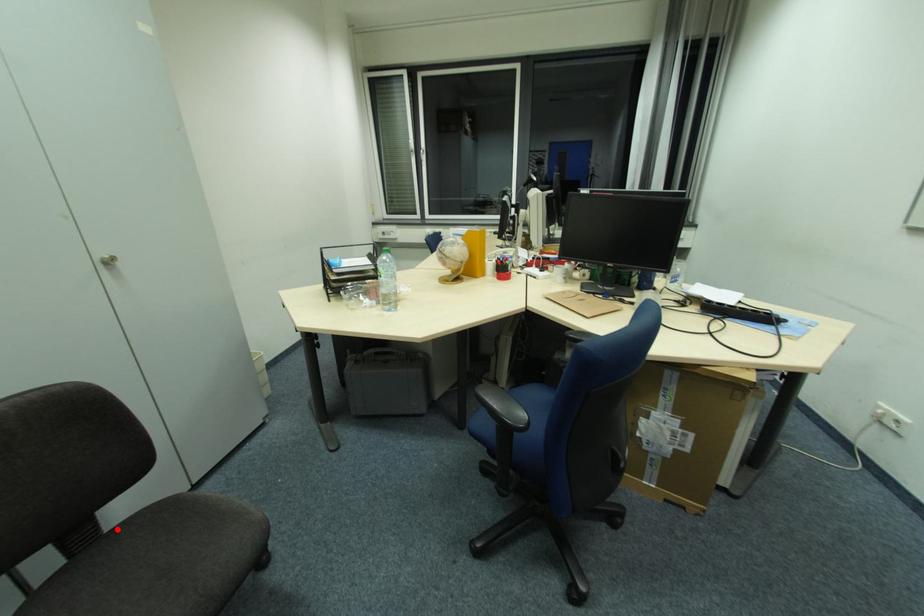
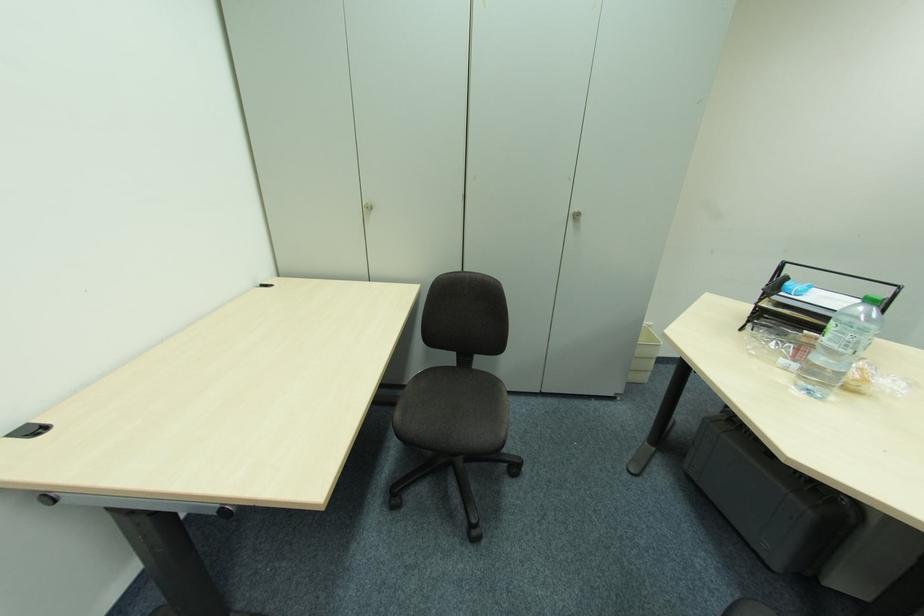
Locate, in the second image, the point that corresponds to the highlighted location in the first image.

(477, 371)